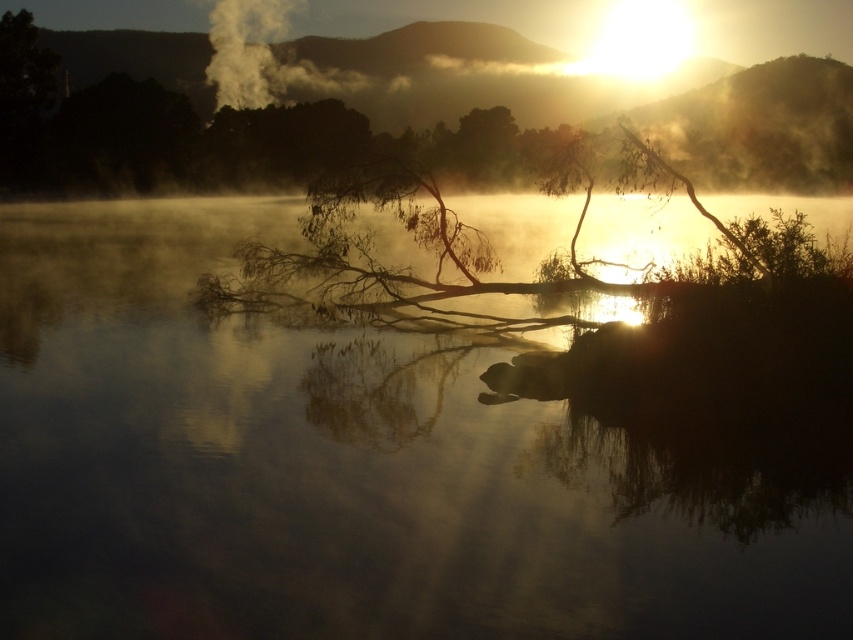
What do you see at coordinates (351, 196) in the screenshot? The image size is (853, 640). I see `brown/dry wood tree at center` at bounding box center [351, 196].

Can you confirm if brown/dry wood tree at center is wider than white smoke at upper center?

Yes, brown/dry wood tree at center is wider than white smoke at upper center.

Is point (430, 236) behind point (265, 36)?

No.

Find the location of a particular element. Image resolution: width=853 pixels, height=640 pixels. brown/dry wood tree at center is located at coordinates (351, 196).

You are a GUI agent. You are given a task and a screenshot of the screen. Output one action in this format:
    pyautogui.click(x=<x>, y=<y>)
    Task: Click on the foggy mist at upper center
    
    Given the screenshot: What is the action you would take?
    pyautogui.click(x=392, y=109)

The image size is (853, 640). I want to click on foggy mist at upper center, so click(x=392, y=109).

Is transparent water at center shorter than brown/dry wood tree at center?

Indeed, transparent water at center has a lesser height compared to brown/dry wood tree at center.

You are a GUI agent. You are given a task and a screenshot of the screen. Output one action in this format:
    pyautogui.click(x=<x>, y=<y>)
    Task: Click on the transparent water at center
    The height and width of the screenshot is (640, 853).
    Given the screenshot: What is the action you would take?
    pyautogui.click(x=354, y=467)